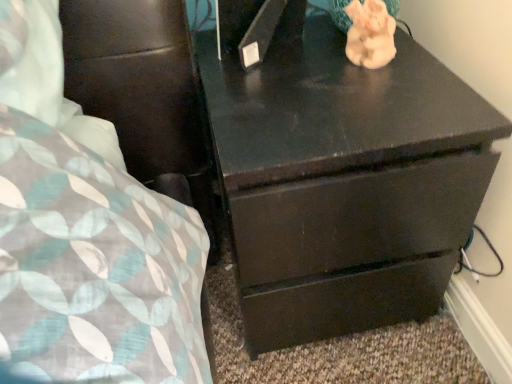
Describe the element at coordinates (344, 181) in the screenshot. The width and height of the screenshot is (512, 384). I see `dark wood chest of drawers at center` at that location.

Measure the distance between point (317, 103) and camera.

They are 26.02 inches apart.

Where is `dark wood chest of drawers at center`? The image size is (512, 384). dark wood chest of drawers at center is located at coordinates (344, 181).

Describe the element at coordinates (370, 34) in the screenshot. I see `porcelain pink elephant at upper right` at that location.

Consider the image. What is the approximate width of porcelain pink elephant at upper right?

6.66 centimeters.

Find the location of a particular element. The image size is (512, 384). porcelain pink elephant at upper right is located at coordinates (370, 34).

This screenshot has width=512, height=384. I want to click on dark wood chest of drawers at center, so click(344, 181).

Would you say dark wood chest of drawers at center is to the left or to the right of porcelain pink elephant at upper right in the picture?

Based on their positions, dark wood chest of drawers at center is located to the left of porcelain pink elephant at upper right.

Which is in front, dark wood chest of drawers at center or porcelain pink elephant at upper right?

dark wood chest of drawers at center is closer to the camera.

Which is closer, (417,109) or (376,66)?

Point (417,109).

From the image's perspective, is dark wood chest of drawers at center below porcelain pink elephant at upper right?

Correct, dark wood chest of drawers at center appears lower than porcelain pink elephant at upper right in the image.

From a real-world perspective, is dark wood chest of drawers at center physically below porcelain pink elephant at upper right?

Correct, in the physical world, dark wood chest of drawers at center is lower than porcelain pink elephant at upper right.

Considering the sizes of dark wood chest of drawers at center and porcelain pink elephant at upper right in the image, is dark wood chest of drawers at center wider or thinner than porcelain pink elephant at upper right?

In the image, dark wood chest of drawers at center appears to be wider than porcelain pink elephant at upper right.

Between dark wood chest of drawers at center and porcelain pink elephant at upper right, which one has less height?

porcelain pink elephant at upper right.

Who is smaller, dark wood chest of drawers at center or porcelain pink elephant at upper right?

porcelain pink elephant at upper right.

Which is correct: dark wood chest of drawers at center is inside porcelain pink elephant at upper right, or outside of it?

dark wood chest of drawers at center exists outside the volume of porcelain pink elephant at upper right.

Is dark wood chest of drawers at center in contact with porcelain pink elephant at upper right?

No, dark wood chest of drawers at center is not beside porcelain pink elephant at upper right.

Is dark wood chest of drawers at center facing towards porcelain pink elephant at upper right?

No, dark wood chest of drawers at center is not aimed at porcelain pink elephant at upper right.

How many degrees apart are the facing directions of dark wood chest of drawers at center and porcelain pink elephant at upper right?

The angle between the facing direction of dark wood chest of drawers at center and the facing direction of porcelain pink elephant at upper right is 54.1 degrees.

The width and height of the screenshot is (512, 384). I want to click on animal above the dark wood chest of drawers at center (from the image's perspective), so click(370, 34).

Based on the photo, which object is positioned more to the right, porcelain pink elephant at upper right or dark wood chest of drawers at center?

From the viewer's perspective, porcelain pink elephant at upper right appears more on the right side.

Which object is further away from the camera taking this photo, porcelain pink elephant at upper right or dark wood chest of drawers at center?

porcelain pink elephant at upper right.

Which is less distant, (356,29) or (470,187)?

Point (356,29) appears to be farther away from the viewer than point (470,187).

From the image's perspective, is porcelain pink elephant at upper right located above dark wood chest of drawers at center?

Yes, from the image's perspective, porcelain pink elephant at upper right is on top of dark wood chest of drawers at center.

From a real-world perspective, is porcelain pink elephant at upper right beneath dark wood chest of drawers at center?

Incorrect, from a real-world perspective, porcelain pink elephant at upper right is higher than dark wood chest of drawers at center.

Looking at their sizes, would you say porcelain pink elephant at upper right is wider or thinner than dark wood chest of drawers at center?

In the image, porcelain pink elephant at upper right appears to be more narrow than dark wood chest of drawers at center.

Which of these two, porcelain pink elephant at upper right or dark wood chest of drawers at center, stands shorter?

porcelain pink elephant at upper right.

Is porcelain pink elephant at upper right bigger than dark wood chest of drawers at center?

Actually, porcelain pink elephant at upper right might be smaller than dark wood chest of drawers at center.

From the picture: Is porcelain pink elephant at upper right located outside dark wood chest of drawers at center?

porcelain pink elephant at upper right lies outside dark wood chest of drawers at center's area.

Are porcelain pink elephant at upper right and dark wood chest of drawers at center far apart?

No, there isn't a large distance between porcelain pink elephant at upper right and dark wood chest of drawers at center.

Is porcelain pink elephant at upper right positioned with its back to dark wood chest of drawers at center?

That's not correct — porcelain pink elephant at upper right is not looking away from dark wood chest of drawers at center.

How many degrees apart are the facing directions of porcelain pink elephant at upper right and dark wood chest of drawers at center?

The angle between the facing direction of porcelain pink elephant at upper right and the facing direction of dark wood chest of drawers at center is 54.1 degrees.

The height and width of the screenshot is (384, 512). Find the location of `chest of drawers that is on the left side of porcelain pink elephant at upper right`. chest of drawers that is on the left side of porcelain pink elephant at upper right is located at coordinates (344, 181).

Where is `chest of drawers below the porcelain pink elephant at upper right (from a real-world perspective)`? chest of drawers below the porcelain pink elephant at upper right (from a real-world perspective) is located at coordinates (344, 181).

What are the coordinates of `animal above the dark wood chest of drawers at center (from the image's perspective)` in the screenshot? It's located at (370, 34).